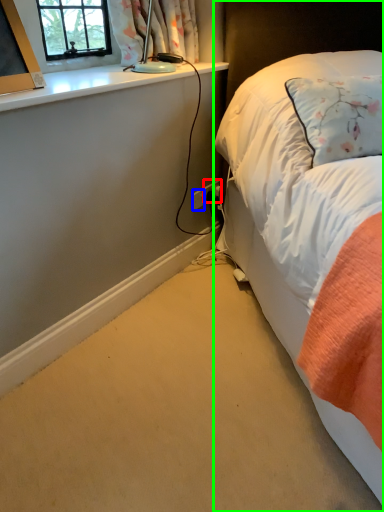
Question: Considering the real-world distances, which object is closest to power plugs and sockets (highlighted by a red box)? power plugs and sockets (highlighted by a blue box) or bed (highlighted by a green box).

Choices:
 (A) power plugs and sockets
 (B) bed

Answer: (A)